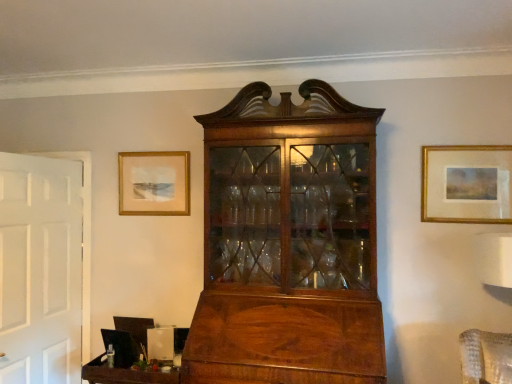
The image size is (512, 384). What do you see at coordinates (467, 184) in the screenshot?
I see `gold-framed painting at upper right, the second picture frame viewed from the left` at bounding box center [467, 184].

I want to click on matte gold picture frame at upper left, the first picture frame in the back-to-front sequence, so click(x=154, y=183).

How many degrees apart are the facing directions of matte gold picture frame at upper left, the first picture frame in the back-to-front sequence, and wooden tray at lower left?

The facing directions of matte gold picture frame at upper left, the first picture frame in the back-to-front sequence, and wooden tray at lower left are 0.383 degrees apart.

Considering the points (149, 212) and (132, 377), which point is in front, point (149, 212) or point (132, 377)?

Point (132, 377)

Consider the image. From their relative heights in the image, would you say matte gold picture frame at upper left, which ranks as the second picture frame in right-to-left order, is taller or shorter than wooden tray at lower left?

In the image, matte gold picture frame at upper left, which ranks as the second picture frame in right-to-left order, appears to be taller than wooden tray at lower left.

Is gold-framed painting at upper right, which is counted as the first picture frame, starting from the front, aimed at matte gold picture frame at upper left, which ranks as the second picture frame in right-to-left order?

No, gold-framed painting at upper right, which is counted as the first picture frame, starting from the front, does not turn towards matte gold picture frame at upper left, which ranks as the second picture frame in right-to-left order.

Which is behind, gold-framed painting at upper right, which ranks as the 2th picture frame in back-to-front order, or matte gold picture frame at upper left, which ranks as the second picture frame in right-to-left order?

matte gold picture frame at upper left, which ranks as the second picture frame in right-to-left order, is more distant.

From the picture: In terms of size, does gold-framed painting at upper right, acting as the 1th picture frame starting from the right, appear bigger or smaller than matte gold picture frame at upper left, the first picture frame in the back-to-front sequence?

gold-framed painting at upper right, acting as the 1th picture frame starting from the right, is bigger than matte gold picture frame at upper left, the first picture frame in the back-to-front sequence.

From the image's perspective, is gold-framed painting at upper right, acting as the 1th picture frame starting from the right, under matte gold picture frame at upper left, which is the second picture frame from front to back?

Yes.

Identify the location of table below the gold-framed painting at upper right, the second picture frame viewed from the left (from the image's perspective). The height and width of the screenshot is (384, 512). (125, 374).

From a real-world perspective, is wooden tray at lower left positioned above or below gold-framed painting at upper right, the second picture frame viewed from the left?

wooden tray at lower left is below gold-framed painting at upper right, the second picture frame viewed from the left.

Which object is more forward, wooden tray at lower left or gold-framed painting at upper right, the second picture frame viewed from the left?

wooden tray at lower left.

From the image's perspective, is wooden tray at lower left above or below gold-framed painting at upper right, which ranks as the 2th picture frame in back-to-front order?

From the image's perspective, wooden tray at lower left appears below gold-framed painting at upper right, which ranks as the 2th picture frame in back-to-front order.

Is wooden tray at lower left touching matte gold picture frame at upper left, the 1th picture frame positioned from the left?

wooden tray at lower left and matte gold picture frame at upper left, the 1th picture frame positioned from the left, are not in contact.

Which is behind, point (167, 374) or point (172, 183)?

Positioned behind is point (172, 183).

From the image's perspective, which object appears higher, wooden tray at lower left or matte gold picture frame at upper left, which is the second picture frame from front to back?

From the image's view, matte gold picture frame at upper left, which is the second picture frame from front to back, is above.

Which object is more forward, wooden tray at lower left or matte gold picture frame at upper left, which ranks as the second picture frame in right-to-left order?

wooden tray at lower left.

Which of these two, matte gold picture frame at upper left, which ranks as the second picture frame in right-to-left order, or gold-framed painting at upper right, the second picture frame viewed from the left, stands taller?

Standing taller between the two is gold-framed painting at upper right, the second picture frame viewed from the left.

Is matte gold picture frame at upper left, the 1th picture frame positioned from the left, bigger than gold-framed painting at upper right, acting as the 1th picture frame starting from the right?

Actually, matte gold picture frame at upper left, the 1th picture frame positioned from the left, might be smaller than gold-framed painting at upper right, acting as the 1th picture frame starting from the right.

Looking at this image, could you tell me if matte gold picture frame at upper left, the first picture frame in the back-to-front sequence, is turned towards gold-framed painting at upper right, which ranks as the 2th picture frame in back-to-front order?

No, matte gold picture frame at upper left, the first picture frame in the back-to-front sequence, does not turn towards gold-framed painting at upper right, which ranks as the 2th picture frame in back-to-front order.

Is gold-framed painting at upper right, the second picture frame viewed from the left, placed right next to wooden tray at lower left?

No, gold-framed painting at upper right, the second picture frame viewed from the left, is not next to wooden tray at lower left.

Between gold-framed painting at upper right, the second picture frame viewed from the left, and wooden tray at lower left, which one is positioned behind?

gold-framed painting at upper right, the second picture frame viewed from the left, is further from the camera.

Could you tell me if gold-framed painting at upper right, which is counted as the first picture frame, starting from the front, is facing wooden tray at lower left?

No, gold-framed painting at upper right, which is counted as the first picture frame, starting from the front, is not turned towards wooden tray at lower left.

Does gold-framed painting at upper right, which ranks as the 2th picture frame in back-to-front order, have a greater height compared to wooden tray at lower left?

Yes.

The width and height of the screenshot is (512, 384). Find the location of `picture frame to the left of wooden tray at lower left`. picture frame to the left of wooden tray at lower left is located at coordinates (154, 183).

In order to click on picture frame that is below the matte gold picture frame at upper left, the first picture frame in the back-to-front sequence (from the image's perspective) in this screenshot , I will do `click(467, 184)`.

Considering their positions, is wooden tray at lower left positioned further to gold-framed painting at upper right, which ranks as the 2th picture frame in back-to-front order, than matte gold picture frame at upper left, the first picture frame in the back-to-front sequence?

wooden tray at lower left lies further to gold-framed painting at upper right, which ranks as the 2th picture frame in back-to-front order, than the other object.

Considering their positions, is gold-framed painting at upper right, acting as the 1th picture frame starting from the right, positioned closer to wooden tray at lower left than matte gold picture frame at upper left, which ranks as the second picture frame in right-to-left order?

matte gold picture frame at upper left, which ranks as the second picture frame in right-to-left order, is closer to wooden tray at lower left.

When comparing their distances from matte gold picture frame at upper left, the 1th picture frame positioned from the left, does gold-framed painting at upper right, acting as the 1th picture frame starting from the right, or wooden tray at lower left seem further?

Based on the image, gold-framed painting at upper right, acting as the 1th picture frame starting from the right, appears to be further to matte gold picture frame at upper left, the 1th picture frame positioned from the left.

From the image, which object appears to be nearer to wooden tray at lower left, matte gold picture frame at upper left, which is the second picture frame from front to back, or gold-framed painting at upper right, the second picture frame viewed from the left?

matte gold picture frame at upper left, which is the second picture frame from front to back, is closer to wooden tray at lower left.

Based on their spatial positions, is matte gold picture frame at upper left, the first picture frame in the back-to-front sequence, or wooden tray at lower left further from gold-framed painting at upper right, which ranks as the 2th picture frame in back-to-front order?

wooden tray at lower left.

Based on their spatial positions, is wooden tray at lower left or gold-framed painting at upper right, which is counted as the first picture frame, starting from the front, closer to matte gold picture frame at upper left, which ranks as the second picture frame in right-to-left order?

wooden tray at lower left lies closer to matte gold picture frame at upper left, which ranks as the second picture frame in right-to-left order, than the other object.

The height and width of the screenshot is (384, 512). Identify the location of table between matte gold picture frame at upper left, which is the second picture frame from front to back, and gold-framed painting at upper right, the second picture frame viewed from the left. (125, 374).